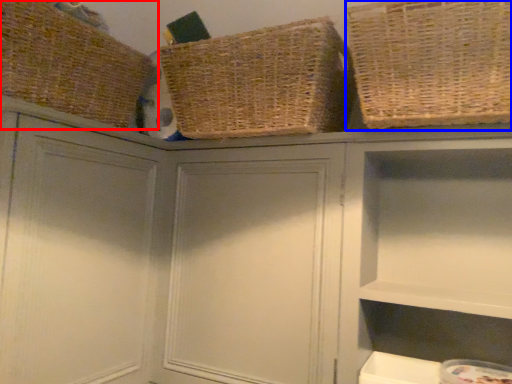
Question: Among these objects, which one is nearest to the camera, basket (highlighted by a red box) or basket (highlighted by a blue box)?

Choices:
 (A) basket
 (B) basket

Answer: (B)